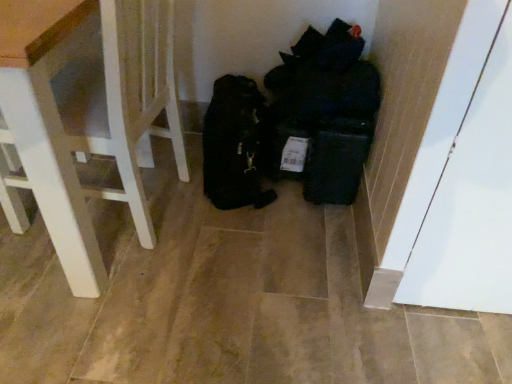
Question: Is black fabric bags at center further to camera compared to white wood chair at left?

Choices:
 (A) no
 (B) yes

Answer: (B)

Question: Does black fabric bags at center turn towards white wood chair at left?

Choices:
 (A) no
 (B) yes

Answer: (A)

Question: Is black fabric bags at center turned away from white wood chair at left?

Choices:
 (A) yes
 (B) no

Answer: (B)

Question: Is black fabric bags at center next to white wood chair at left and touching it?

Choices:
 (A) no
 (B) yes

Answer: (A)

Question: Is black fabric bags at center outside of white wood chair at left?

Choices:
 (A) no
 (B) yes

Answer: (B)

Question: Is black fabric bags at center to the left of white wood chair at left from the viewer's perspective?

Choices:
 (A) no
 (B) yes

Answer: (A)

Question: Can you confirm if white wood chair at left is smaller than black fabric bags at center?

Choices:
 (A) no
 (B) yes

Answer: (A)

Question: Is white wood chair at left oriented towards black fabric bags at center?

Choices:
 (A) yes
 (B) no

Answer: (A)

Question: Does white wood chair at left come in front of black fabric bags at center?

Choices:
 (A) yes
 (B) no

Answer: (A)

Question: Is white wood chair at left bigger than black fabric bags at center?

Choices:
 (A) yes
 (B) no

Answer: (A)

Question: Can you confirm if white wood chair at left is thinner than black fabric bags at center?

Choices:
 (A) yes
 (B) no

Answer: (B)

Question: Does white wood chair at left have a greater height compared to black fabric bags at center?

Choices:
 (A) yes
 (B) no

Answer: (A)

Question: In the image, is white wood chair at left on the left side or the right side of black fabric bags at center?

Choices:
 (A) left
 (B) right

Answer: (A)